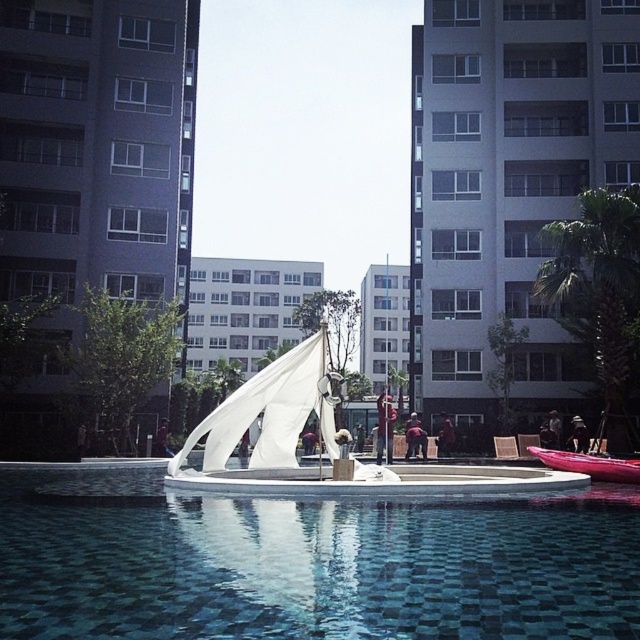
Based on the photo, does blue glossy water at center appear over shiny red canoe at lower right?

Yes, blue glossy water at center is above shiny red canoe at lower right.

Does point (429, 625) lie behind point (573, 451)?

That is False.

What do you see at coordinates (305, 564) in the screenshot? The width and height of the screenshot is (640, 640). I see `blue glossy water at center` at bounding box center [305, 564].

Identify the location of blue glossy water at center. (305, 564).

Does white fabric canopy at center lie in front of shiny red canoe at lower right?

That is True.

Is white fabric canopy at center behind shiny red canoe at lower right?

No, it is in front of shiny red canoe at lower right.

Who is more distant from viewer, [300,372] or [608,476]?

Positioned behind is point [300,372].

You are a GUI agent. You are given a task and a screenshot of the screen. Output one action in this format:
    pyautogui.click(x=<x>, y=<y>)
    Task: Click on the white fabric canopy at center
    The height and width of the screenshot is (640, 640).
    Given the screenshot: What is the action you would take?
    pyautogui.click(x=269, y=412)

Which is more to the right, blue glossy water at center or white fabric canopy at center?

From the viewer's perspective, blue glossy water at center appears more on the right side.

Is point (428, 582) farther from camera compared to point (252, 380)?

No, it is in front of (252, 380).

Where is `blue glossy water at center`? Image resolution: width=640 pixels, height=640 pixels. blue glossy water at center is located at coordinates (305, 564).

Where is `blue glossy water at center`? Image resolution: width=640 pixels, height=640 pixels. blue glossy water at center is located at coordinates (305, 564).